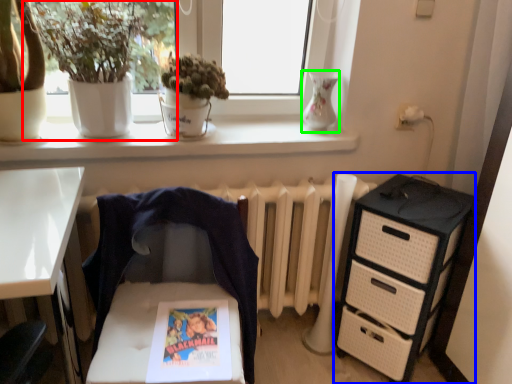
Question: Which object is the farthest from houseplant (highlighted by a red box)? Choose among these: chest of drawers (highlighted by a blue box) or vase (highlighted by a green box).

Choices:
 (A) chest of drawers
 (B) vase

Answer: (A)